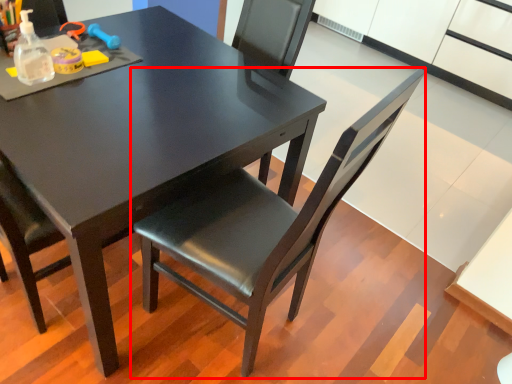
Question: In this image, where is chair (annotated by the red box) located relative to table?

Choices:
 (A) left
 (B) right

Answer: (B)